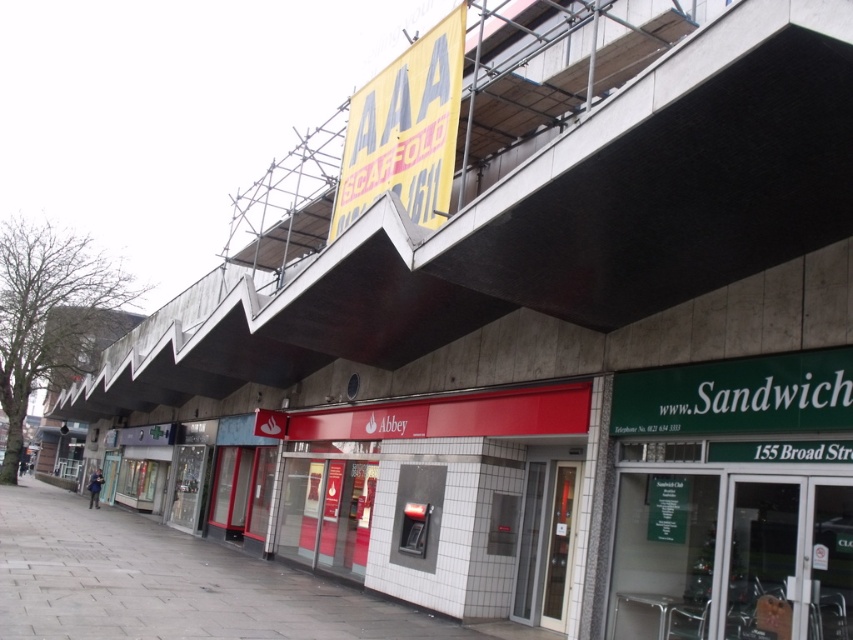
Question: Which point is closer to the camera?

Choices:
 (A) gray concrete pavement at lower left
 (B) concrete at upper center
 (C) yellow paper sign at upper center

Answer: (B)

Question: Is concrete at upper center to the right of gray concrete pavement at lower left from the viewer's perspective?

Choices:
 (A) no
 (B) yes

Answer: (B)

Question: Does concrete at upper center have a smaller size compared to gray concrete pavement at lower left?

Choices:
 (A) yes
 (B) no

Answer: (B)

Question: Which of the following is the farthest from the observer?

Choices:
 (A) concrete at upper center
 (B) yellow paper sign at upper center
 (C) gray concrete pavement at lower left

Answer: (B)

Question: Which object is the farthest from the yellow paper sign at upper center?

Choices:
 (A) gray concrete pavement at lower left
 (B) concrete at upper center

Answer: (A)

Question: Does concrete at upper center appear under yellow paper sign at upper center?

Choices:
 (A) no
 (B) yes

Answer: (B)